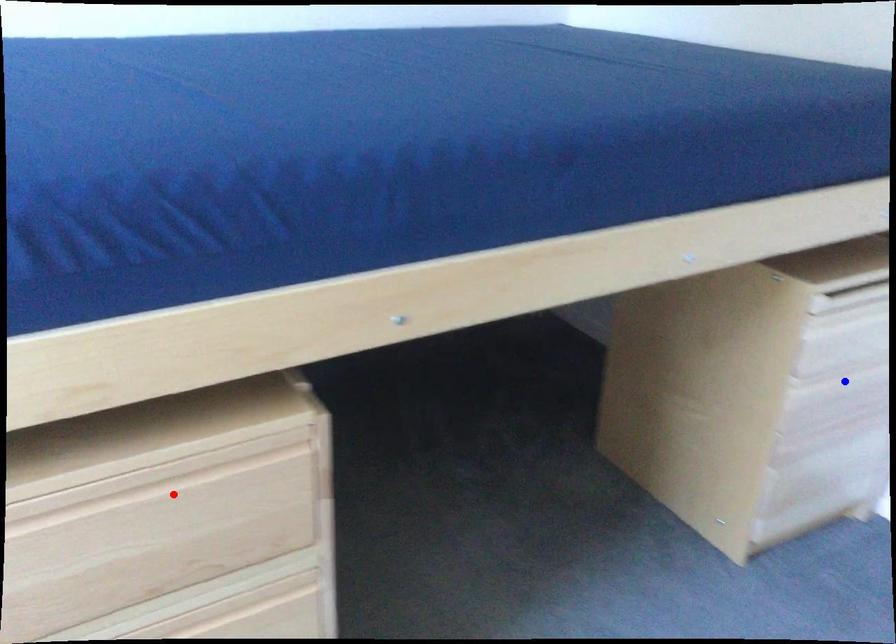
Question: In the image, two points are highlighted. Which point is nearer to the camera? Reply with the corresponding letter.

Choices:
 (A) blue point
 (B) red point

Answer: (B)